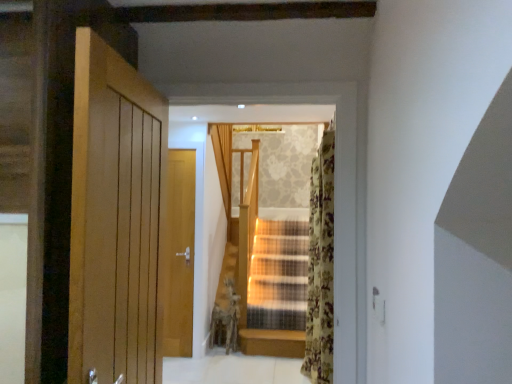
Question: Based on their positions, is floral fabric curtain at right, which is the first curtain in right-to-left order, located to the left or right of light beige fabric curtain at center, arranged as the 1th curtain when viewed from the back?

Choices:
 (A) left
 (B) right

Answer: (B)

Question: From the image's perspective, is floral fabric curtain at right, which appears as the second curtain when viewed from the left, positioned above or below light beige fabric curtain at center, arranged as the 1th curtain when viewed from the back?

Choices:
 (A) below
 (B) above

Answer: (A)

Question: Is floral fabric curtain at right, which appears as the second curtain when viewed from the left, inside or outside of light beige fabric curtain at center, which is counted as the 2th curtain, starting from the front?

Choices:
 (A) outside
 (B) inside

Answer: (A)

Question: Considering the positions of light beige fabric curtain at center, which is counted as the 2th curtain, starting from the front, and floral fabric curtain at right, which is the first curtain in right-to-left order, in the image, is light beige fabric curtain at center, which is counted as the 2th curtain, starting from the front, taller or shorter than floral fabric curtain at right, which is the first curtain in right-to-left order,?

Choices:
 (A) tall
 (B) short

Answer: (B)

Question: Based on their positions, is light beige fabric curtain at center, which is counted as the 2th curtain, starting from the front, located to the left or right of floral fabric curtain at right, which appears as the second curtain when viewed from the left?

Choices:
 (A) left
 (B) right

Answer: (A)

Question: In terms of width, does light beige fabric curtain at center, which is the first curtain from left to right, look wider or thinner when compared to floral fabric curtain at right, the 2th curtain in the back-to-front sequence?

Choices:
 (A) wide
 (B) thin

Answer: (B)

Question: Considering their positions, is light beige fabric curtain at center, which is the first curtain from left to right, located in front of or behind floral fabric curtain at right, the 1th curtain positioned from the front?

Choices:
 (A) front
 (B) behind

Answer: (B)